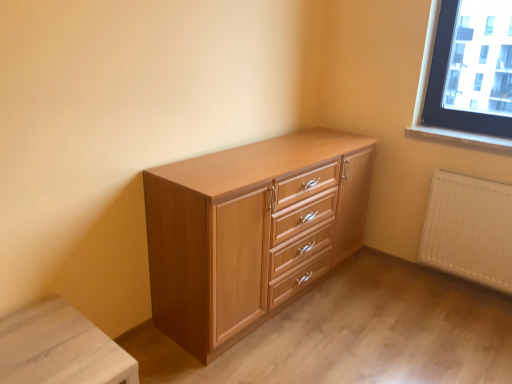
Locate an element on the screen. This screenshot has width=512, height=384. free space above white matte radiator at lower right (from a real-world perspective) is located at coordinates (483, 175).